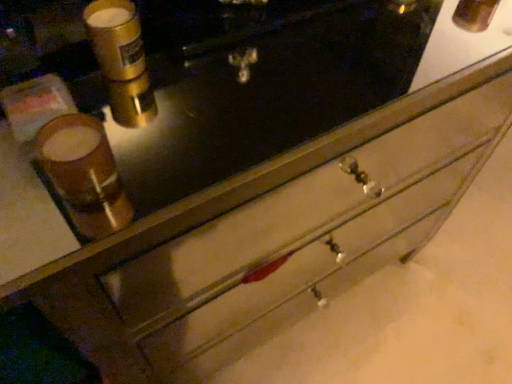
Where is `matte brown cup at left, the second beverage in the back-to-front sequence`? Image resolution: width=512 pixels, height=384 pixels. matte brown cup at left, the second beverage in the back-to-front sequence is located at coordinates (78, 159).

In order to face matte brown cup at left, which is counted as the 1th beverage, starting from the front, should I rotate leftwards or rightwards?

A 23.166 degree turn to the left will do.

Describe the element at coordinates (78, 159) in the screenshot. I see `matte brown cup at left, the second beverage when ordered from top to bottom` at that location.

The height and width of the screenshot is (384, 512). What do you see at coordinates (116, 38) in the screenshot?
I see `gold metallic canister at upper left, the 1th beverage in the top-to-bottom sequence` at bounding box center [116, 38].

Where is `gold metallic canister at upper left, positioned as the 2th beverage in bottom-to-top order`? The height and width of the screenshot is (384, 512). gold metallic canister at upper left, positioned as the 2th beverage in bottom-to-top order is located at coordinates (116, 38).

Find the location of `matte brown cup at left, the second beverage when ordered from top to bottom`. matte brown cup at left, the second beverage when ordered from top to bottom is located at coordinates (78, 159).

Does gold metallic canister at upper left, placed as the second beverage when sorted from front to back, appear on the left side of matte brown cup at left, the second beverage in the back-to-front sequence?

In fact, gold metallic canister at upper left, placed as the second beverage when sorted from front to back, is to the right of matte brown cup at left, the second beverage in the back-to-front sequence.

Is gold metallic canister at upper left, placed as the second beverage when sorted from front to back, closer to camera compared to matte brown cup at left, the second beverage when ordered from top to bottom?

No, it is not.

Is point (129, 29) less distant than point (104, 169)?

No, (129, 29) is behind (104, 169).

From the image's perspective, relative to matte brown cup at left, the second beverage in the back-to-front sequence, is gold metallic canister at upper left, the 1th beverage in the top-to-bottom sequence, above or below?

From the image's perspective, gold metallic canister at upper left, the 1th beverage in the top-to-bottom sequence, appears above matte brown cup at left, the second beverage in the back-to-front sequence.

From a real-world perspective, is gold metallic canister at upper left, acting as the first beverage starting from the back, under matte brown cup at left, the second beverage in the back-to-front sequence?

Indeed, from a real-world perspective, gold metallic canister at upper left, acting as the first beverage starting from the back, is positioned beneath matte brown cup at left, the second beverage in the back-to-front sequence.

In the scene shown: Considering the sizes of objects gold metallic canister at upper left, the 1th beverage in the top-to-bottom sequence, and matte brown cup at left, which is counted as the 1th beverage, starting from the front, in the image provided, who is wider, gold metallic canister at upper left, the 1th beverage in the top-to-bottom sequence, or matte brown cup at left, which is counted as the 1th beverage, starting from the front,?

matte brown cup at left, which is counted as the 1th beverage, starting from the front, is wider.

Which of these two, gold metallic canister at upper left, positioned as the 2th beverage in bottom-to-top order, or matte brown cup at left, which is counted as the 1th beverage, starting from the front, stands taller?

With more height is gold metallic canister at upper left, positioned as the 2th beverage in bottom-to-top order.

Between gold metallic canister at upper left, the 1th beverage in the top-to-bottom sequence, and matte brown cup at left, positioned as the first beverage in bottom-to-top order, which one has larger size?

matte brown cup at left, positioned as the first beverage in bottom-to-top order.

Is matte brown cup at left, positioned as the first beverage in bottom-to-top order, completely or partially inside gold metallic canister at upper left, placed as the second beverage when sorted from front to back?

No, matte brown cup at left, positioned as the first beverage in bottom-to-top order, is not surrounded by gold metallic canister at upper left, placed as the second beverage when sorted from front to back.

Is gold metallic canister at upper left, acting as the first beverage starting from the back, far from matte brown cup at left, positioned as the first beverage in bottom-to-top order?

No.

Is gold metallic canister at upper left, positioned as the 2th beverage in bottom-to-top order, looking in the opposite direction of matte brown cup at left, the second beverage in the back-to-front sequence?

No.

The width and height of the screenshot is (512, 384). In order to click on beverage on the left side of gold metallic canister at upper left, the 1th beverage in the top-to-bottom sequence in this screenshot , I will do `click(78, 159)`.

Visually, is matte brown cup at left, positioned as the first beverage in bottom-to-top order, positioned to the left or to the right of gold metallic canister at upper left, positioned as the 2th beverage in bottom-to-top order?

In the image, matte brown cup at left, positioned as the first beverage in bottom-to-top order, appears on the left side of gold metallic canister at upper left, positioned as the 2th beverage in bottom-to-top order.

Which is in front, matte brown cup at left, the second beverage when ordered from top to bottom, or gold metallic canister at upper left, positioned as the 2th beverage in bottom-to-top order?

matte brown cup at left, the second beverage when ordered from top to bottom.

Considering the points (106, 146) and (127, 21), which point is in front, point (106, 146) or point (127, 21)?

Point (106, 146)

Consider the image. From the image's perspective, between matte brown cup at left, the second beverage in the back-to-front sequence, and gold metallic canister at upper left, positioned as the 2th beverage in bottom-to-top order, who is located below?

matte brown cup at left, the second beverage in the back-to-front sequence, appears lower in the image.

From a real-world perspective, is matte brown cup at left, the second beverage when ordered from top to bottom, above or below gold metallic canister at upper left, positioned as the 2th beverage in bottom-to-top order?

From a real-world perspective, matte brown cup at left, the second beverage when ordered from top to bottom, is physically above gold metallic canister at upper left, positioned as the 2th beverage in bottom-to-top order.

Which object is thinner, matte brown cup at left, which is counted as the 1th beverage, starting from the front, or gold metallic canister at upper left, placed as the second beverage when sorted from front to back?

Thinner between the two is gold metallic canister at upper left, placed as the second beverage when sorted from front to back.

Which of these two, matte brown cup at left, the second beverage when ordered from top to bottom, or gold metallic canister at upper left, the 1th beverage in the top-to-bottom sequence, stands shorter?

matte brown cup at left, the second beverage when ordered from top to bottom.

Considering the sizes of matte brown cup at left, the second beverage when ordered from top to bottom, and gold metallic canister at upper left, acting as the first beverage starting from the back, in the image, is matte brown cup at left, the second beverage when ordered from top to bottom, bigger or smaller than gold metallic canister at upper left, acting as the first beverage starting from the back,?

In the image, matte brown cup at left, the second beverage when ordered from top to bottom, appears to be larger than gold metallic canister at upper left, acting as the first beverage starting from the back.

Is matte brown cup at left, the second beverage in the back-to-front sequence, not within gold metallic canister at upper left, the 1th beverage in the top-to-bottom sequence?

Absolutely, matte brown cup at left, the second beverage in the back-to-front sequence, is external to gold metallic canister at upper left, the 1th beverage in the top-to-bottom sequence.

Is matte brown cup at left, positioned as the first beverage in bottom-to-top order, far away from gold metallic canister at upper left, placed as the second beverage when sorted from front to back?

No, matte brown cup at left, positioned as the first beverage in bottom-to-top order, is not far away from gold metallic canister at upper left, placed as the second beverage when sorted from front to back.

Does matte brown cup at left, the second beverage in the back-to-front sequence, turn towards gold metallic canister at upper left, acting as the first beverage starting from the back?

No, matte brown cup at left, the second beverage in the back-to-front sequence, is not facing towards gold metallic canister at upper left, acting as the first beverage starting from the back.

Where is `beverage below the matte brown cup at left, the second beverage in the back-to-front sequence (from a real-world perspective)`? Image resolution: width=512 pixels, height=384 pixels. beverage below the matte brown cup at left, the second beverage in the back-to-front sequence (from a real-world perspective) is located at coordinates (116, 38).

Image resolution: width=512 pixels, height=384 pixels. In order to click on beverage located underneath the matte brown cup at left, the second beverage when ordered from top to bottom (from a real-world perspective) in this screenshot , I will do tap(116, 38).

Locate an element on the screen. This screenshot has width=512, height=384. beverage that appears on the left of gold metallic canister at upper left, acting as the first beverage starting from the back is located at coordinates (78, 159).